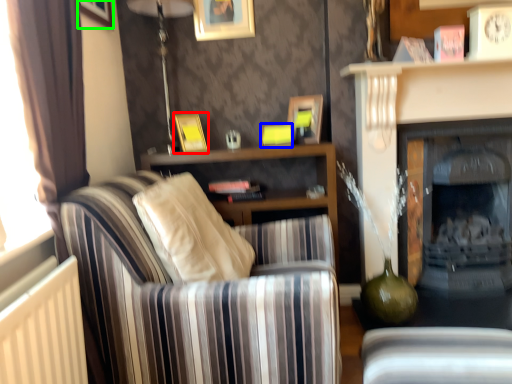
Question: Considering the real-world distances, which object is closest to picture frame (highlighted by a red box)? picture frame (highlighted by a blue box) or picture frame (highlighted by a green box).

Choices:
 (A) picture frame
 (B) picture frame

Answer: (A)